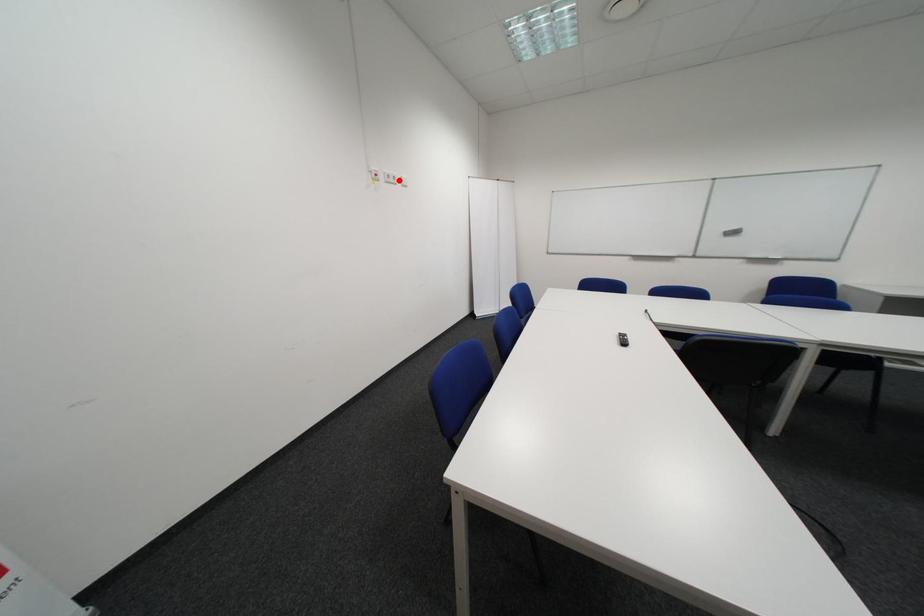
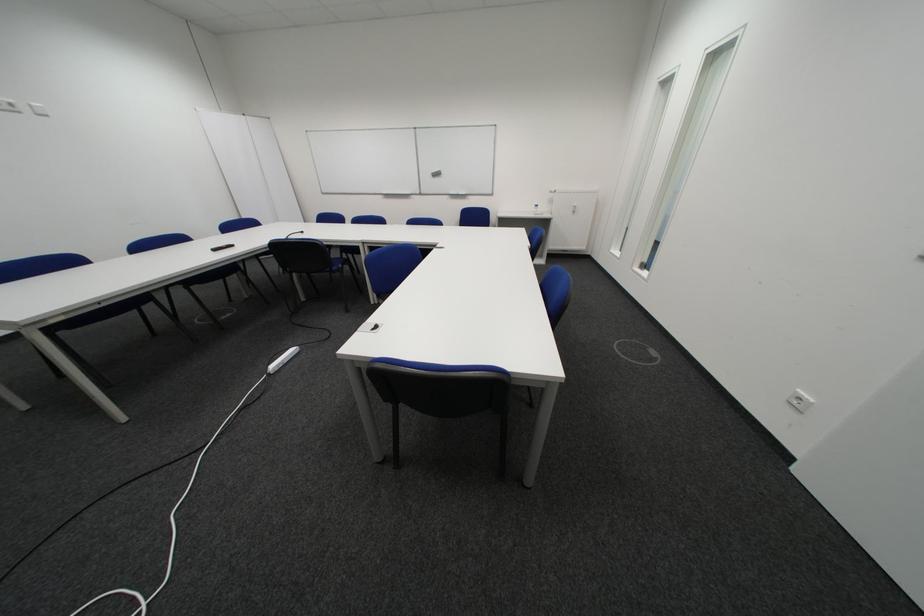
In the second image, find the point that corresponds to the highlighted location in the first image.

(8, 108)